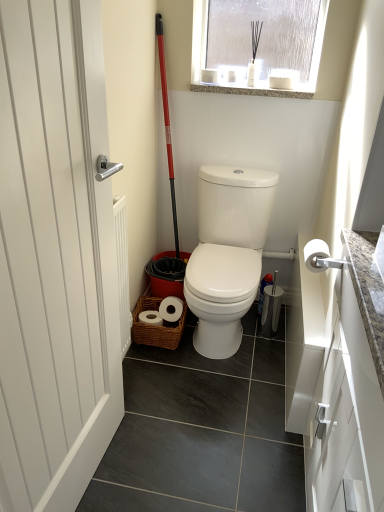
Question: From a real-world perspective, is granite at upper center on top of white matte toilet paper at right?

Choices:
 (A) no
 (B) yes

Answer: (B)

Question: Is granite at upper center smaller than white matte toilet paper at right?

Choices:
 (A) no
 (B) yes

Answer: (A)

Question: Is granite at upper center positioned with its back to white matte toilet paper at right?

Choices:
 (A) yes
 (B) no

Answer: (B)

Question: Does granite at upper center turn towards white matte toilet paper at right?

Choices:
 (A) yes
 (B) no

Answer: (B)

Question: From the image's perspective, is granite at upper center under white matte toilet paper at right?

Choices:
 (A) yes
 (B) no

Answer: (B)

Question: Is white matte door at left inside or outside of white matte toilet paper at right?

Choices:
 (A) inside
 (B) outside

Answer: (B)

Question: From their relative heights in the image, would you say white matte door at left is taller or shorter than white matte toilet paper at right?

Choices:
 (A) short
 (B) tall

Answer: (B)

Question: Considering the positions of point (29, 173) and point (314, 264), is point (29, 173) closer or farther from the camera than point (314, 264)?

Choices:
 (A) closer
 (B) farther

Answer: (A)

Question: Relative to white matte toilet paper at right, is white matte door at left in front or behind?

Choices:
 (A) front
 (B) behind

Answer: (A)

Question: In the image, is granite at upper center positioned in front of or behind white matte toilet paper at right?

Choices:
 (A) behind
 (B) front

Answer: (A)

Question: From the image's perspective, is granite at upper center positioned above or below white matte toilet paper at right?

Choices:
 (A) below
 (B) above

Answer: (B)

Question: Considering the positions of granite at upper center and white matte toilet paper at right in the image, is granite at upper center taller or shorter than white matte toilet paper at right?

Choices:
 (A) tall
 (B) short

Answer: (B)

Question: Do you think granite at upper center is within white matte toilet paper at right, or outside of it?

Choices:
 (A) outside
 (B) inside

Answer: (A)

Question: From the image's perspective, relative to granite at upper center, is white matte door at left above or below?

Choices:
 (A) below
 (B) above

Answer: (A)

Question: Choose the correct answer: Is white matte door at left inside granite at upper center or outside it?

Choices:
 (A) inside
 (B) outside

Answer: (B)